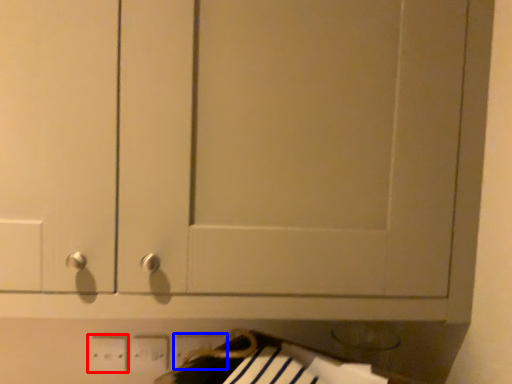
Question: Which object appears closest to the camera in this image, electric outlet (highlighted by a red box) or electric outlet (highlighted by a blue box)?

Choices:
 (A) electric outlet
 (B) electric outlet

Answer: (A)